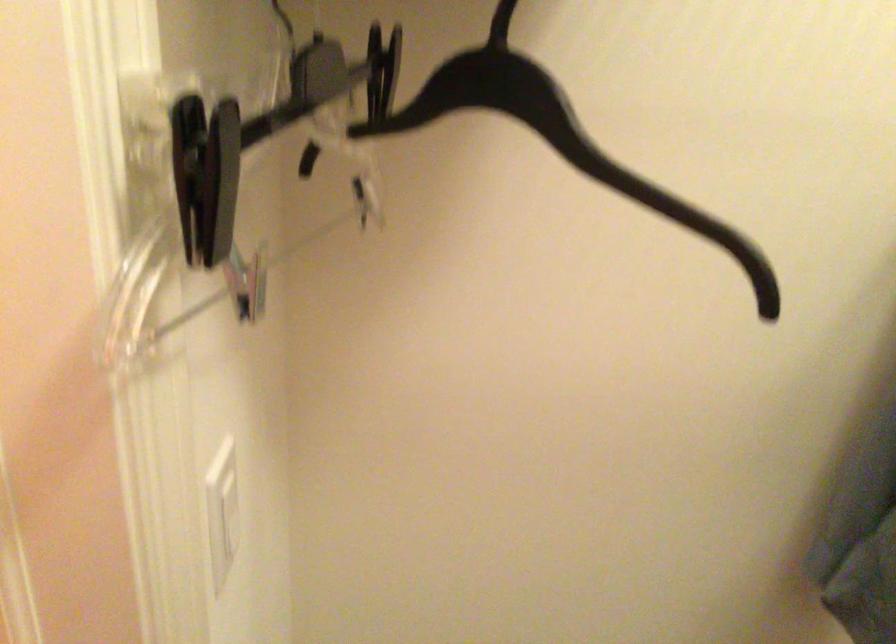
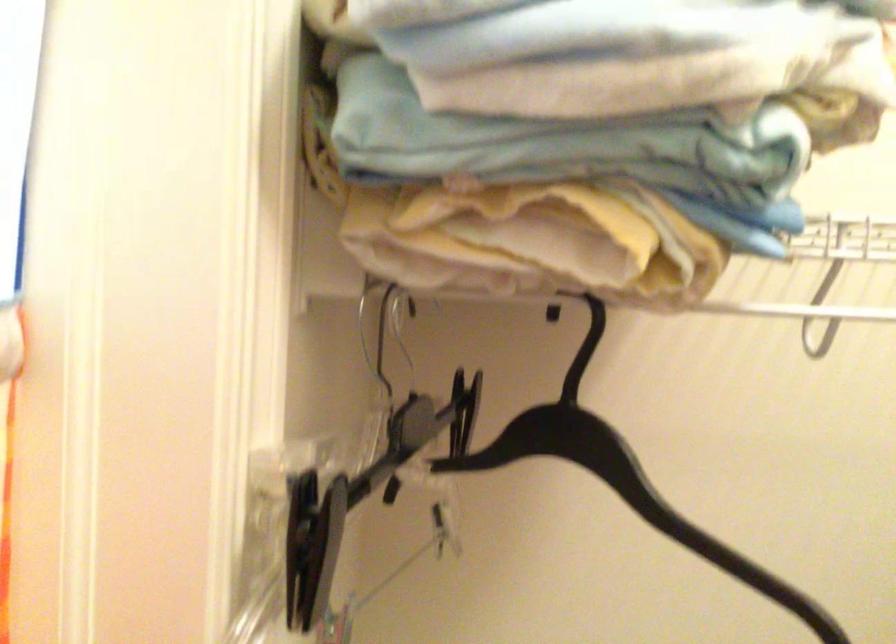
Where in the second image is the point corresponding to (553,86) from the first image?

(624, 478)